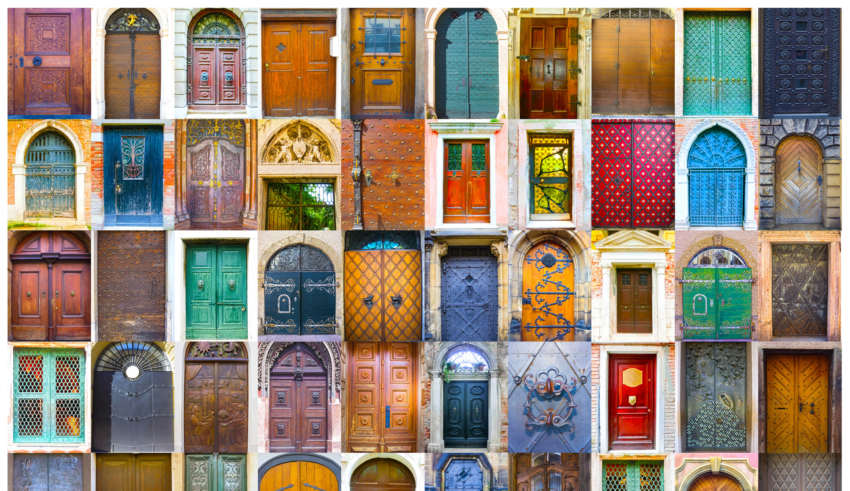
This screenshot has width=850, height=491. In order to click on doors with openings or windows in this screenshot , I will do `click(382, 42)`, `click(476, 160)`, `click(48, 399)`, `click(643, 472)`, `click(240, 468)`, `click(319, 187)`.